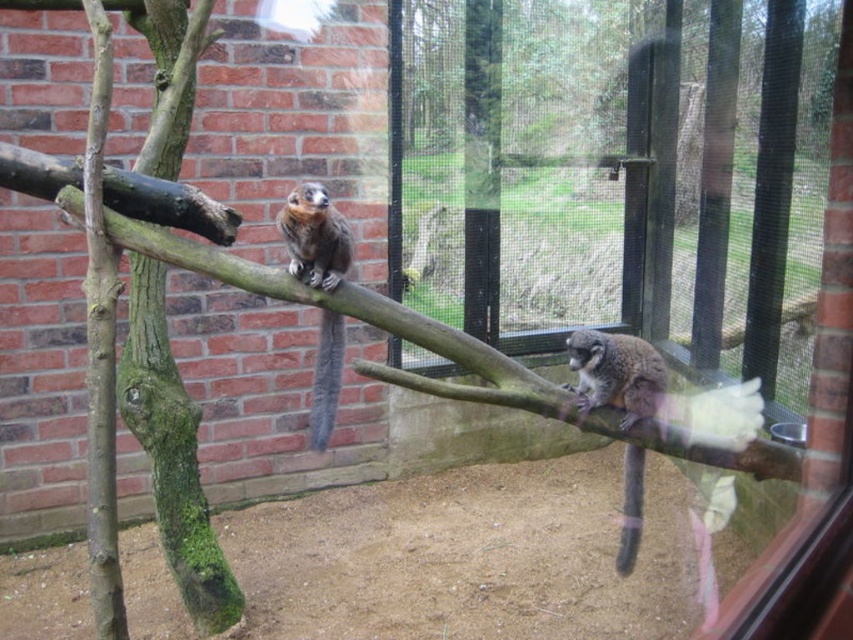
Question: Is gray furry tail at center positioned at the back of brown furry tail at lower right?

Choices:
 (A) no
 (B) yes

Answer: (A)

Question: Which point appears closest to the camera in this image?

Choices:
 (A) (310, 408)
 (B) (639, 454)

Answer: (B)

Question: Is brown textured branch at upper center smaller than brown furry tail at lower right?

Choices:
 (A) yes
 (B) no

Answer: (B)

Question: Which point is closer to the camera?

Choices:
 (A) (317, 225)
 (B) (506, 365)
 (C) (637, 456)

Answer: (B)

Question: Is brown textured branch at upper center bigger than gray furry monkey at right?

Choices:
 (A) yes
 (B) no

Answer: (A)

Question: Among these objects, which one is farthest from the camera?

Choices:
 (A) gray furry monkey at right
 (B) brown textured branch at upper center
 (C) brown furry tail at lower right
 (D) gray furry tail at center

Answer: (C)